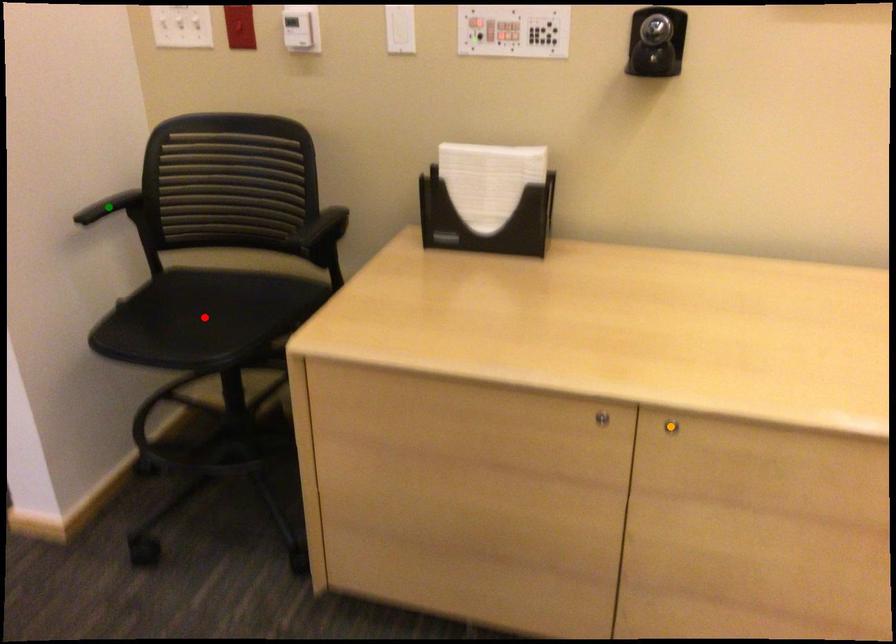
Order these from nearest to farthest:
A) orange point
B) red point
C) green point

1. red point
2. green point
3. orange point